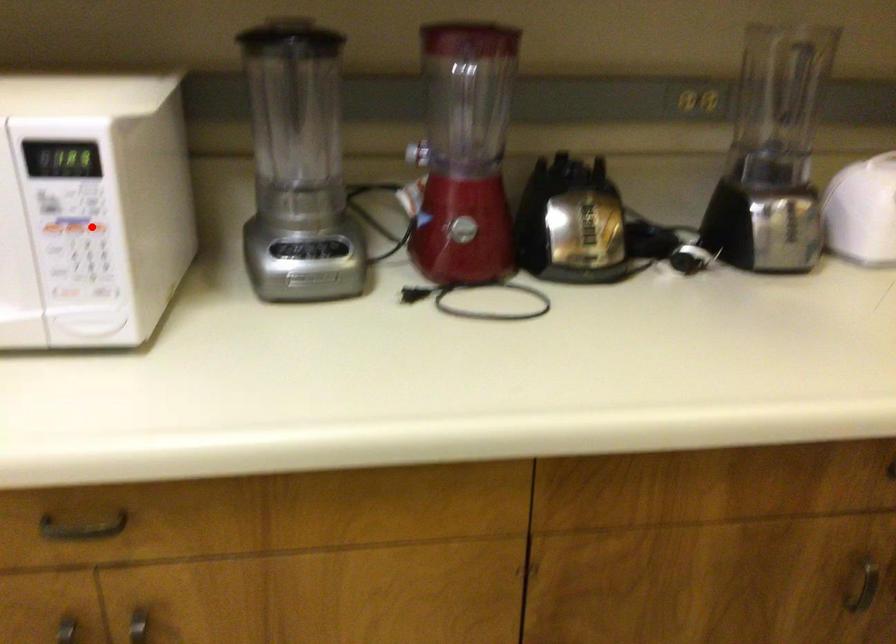
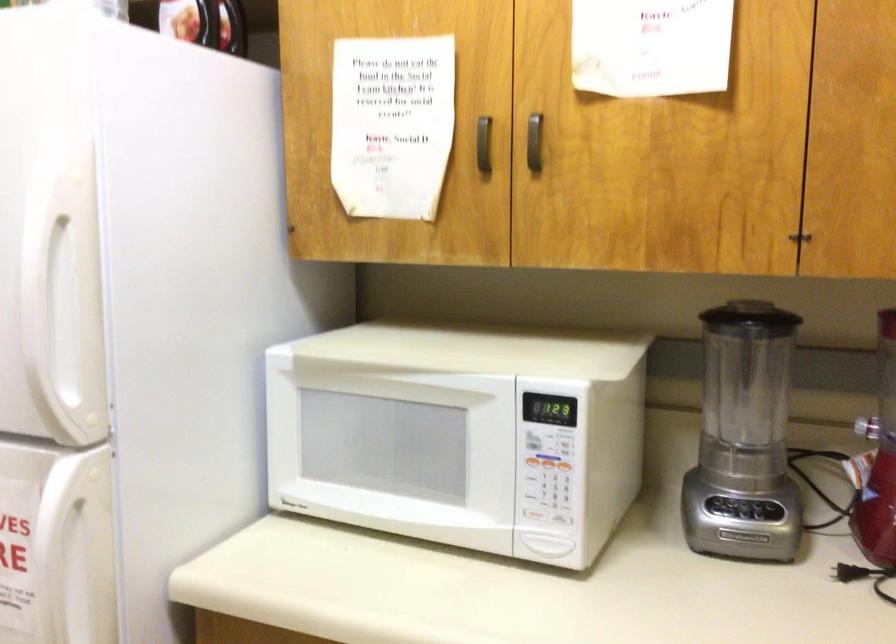
In the second image, find the point that corresponds to the highlighted location in the first image.

(565, 467)